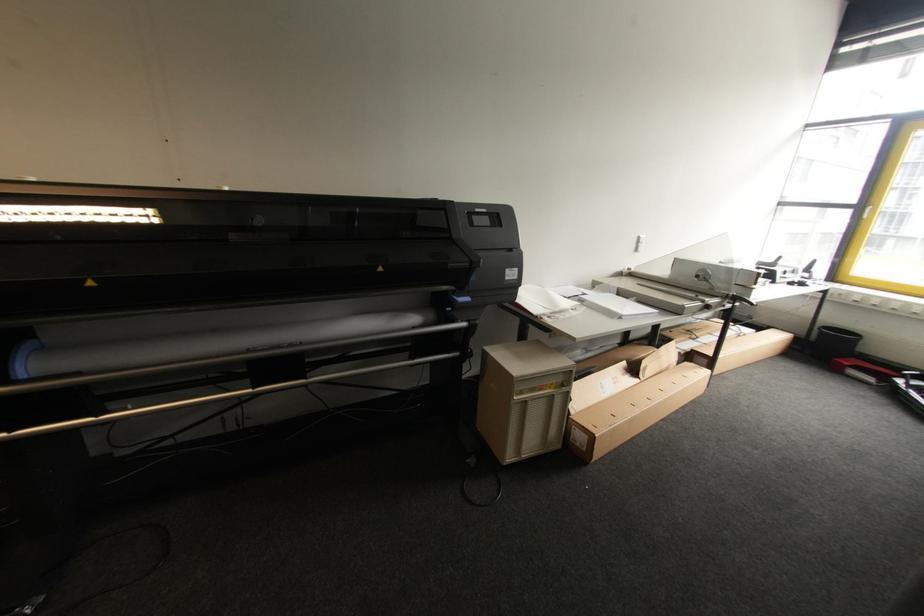
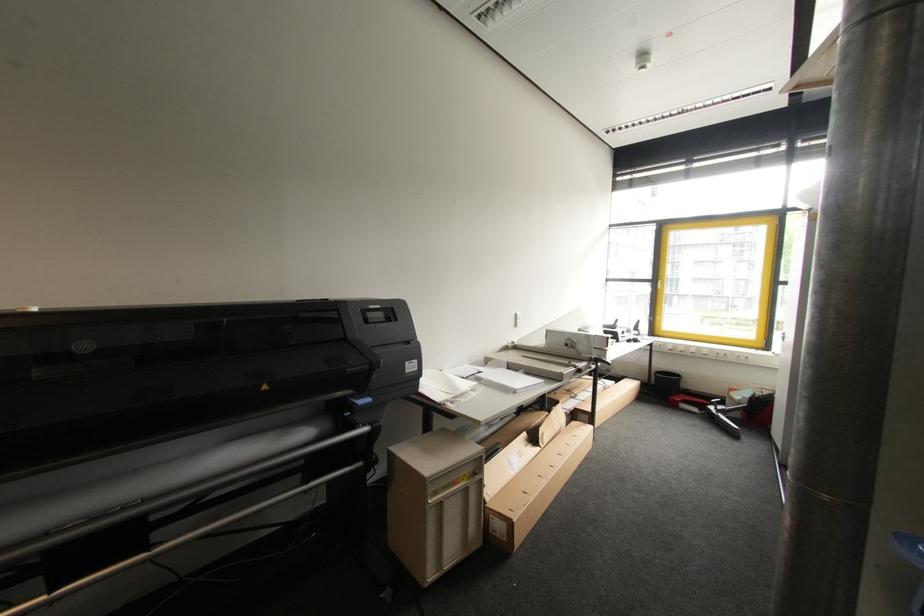
The point at (582, 438) is marked in the first image. Where is the corresponding point in the second image?

(503, 527)